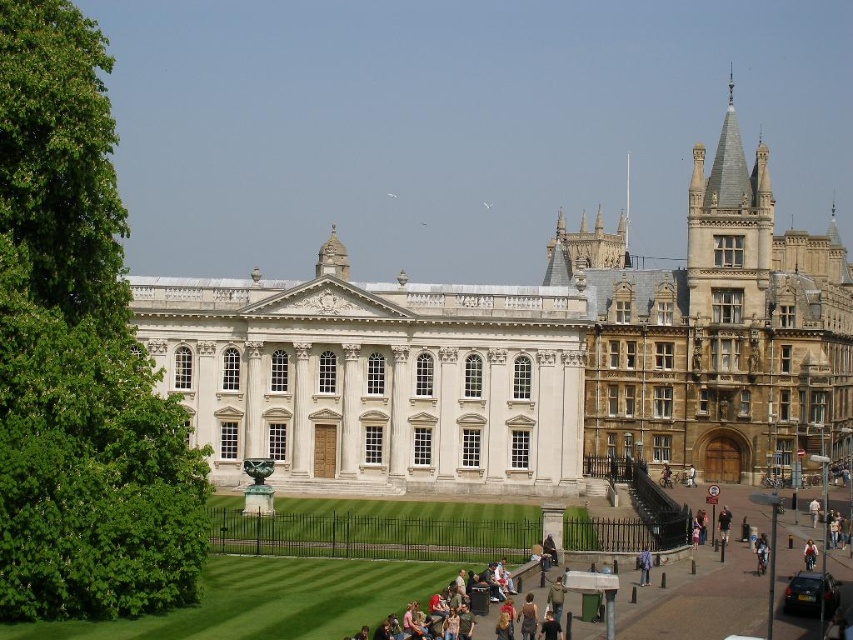
You are standing in front of the grand historic building and notice a black fabric jacket at lower right. Which side of the jacket is closer to the main entrance of the brown stone building at right?

The brown stone building at right is positioned on the right side of the black fabric jacket at lower right, so the right side of the jacket is closer to the main entrance of the brown stone building at right.

You are standing in front of the grand historic building and want to take a photo that includes both the main white structure and the brown stone building at right. Given that your camera has a maximum zoom range of 50 meters, will you be able to capture both buildings in a single frame without moving closer?

The brown stone building at right is 116.08 meters away from the viewer. Since the camera can only zoom up to 50 meters, it cannot capture the brown stone building at right in a single frame without moving closer.